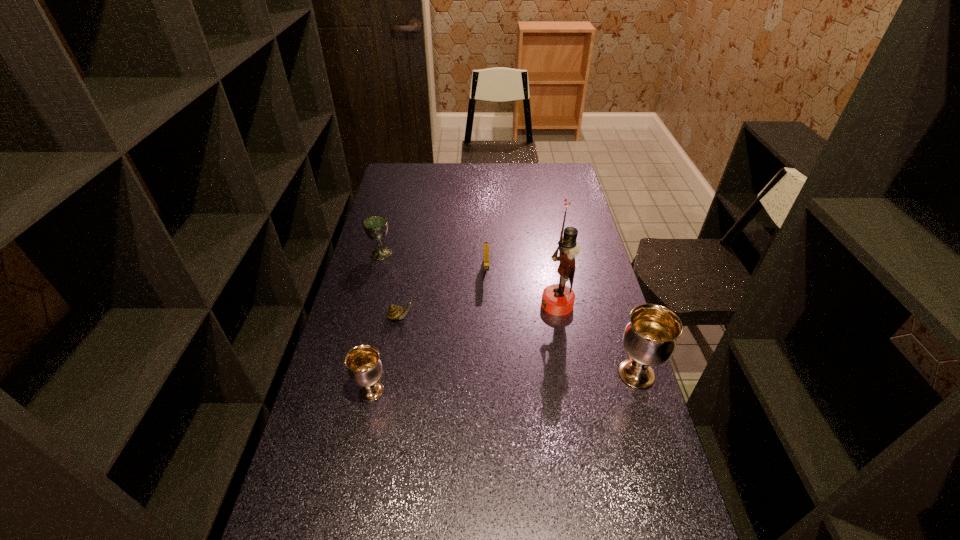
Where is `free space at the far left corner of the desktop`? free space at the far left corner of the desktop is located at coordinates (419, 169).

The image size is (960, 540). I want to click on vacant space at the far right corner, so click(x=565, y=170).

You are a GUI agent. You are given a task and a screenshot of the screen. Output one action in this format:
    pyautogui.click(x=<x>, y=<y>)
    Task: Click on the free space between the farthest chalice and the snail
    This screenshot has width=960, height=540.
    Given the screenshot: What is the action you would take?
    pyautogui.click(x=391, y=285)

This screenshot has width=960, height=540. Find the location of `free space between the farthest chalice and the snail`. free space between the farthest chalice and the snail is located at coordinates (391, 285).

Locate an element on the screen. The image size is (960, 540). vacant area that lies between the snail and the nutcracker is located at coordinates (479, 310).

This screenshot has width=960, height=540. Find the location of `free area in between the rightmost chalice and the farthest chalice`. free area in between the rightmost chalice and the farthest chalice is located at coordinates (509, 314).

Image resolution: width=960 pixels, height=540 pixels. What are the coordinates of `free space between the rightmost object and the pistol` in the screenshot? It's located at (562, 323).

Identify the location of empty space between the farthest chalice and the snail. (391, 285).

This screenshot has width=960, height=540. I want to click on free space between the nutcracker and the snail, so click(x=479, y=310).

At what (x,y) coordinates should I click in order to perform the action: click on free area in between the nutcracker and the snail. Please return your answer as a coordinate pair (x, y). This screenshot has width=960, height=540. Looking at the image, I should click on (479, 310).